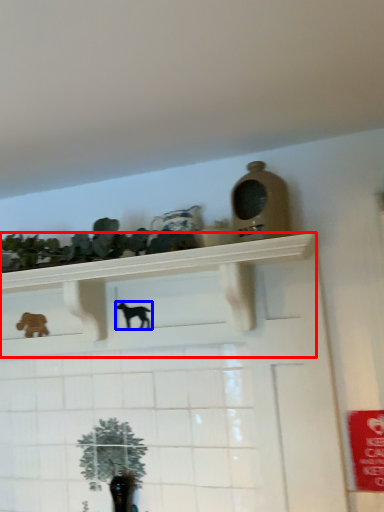
Question: Which point is closer to the camera, shelf (highlighted by a red box) or animal (highlighted by a blue box)?

Choices:
 (A) shelf
 (B) animal

Answer: (A)